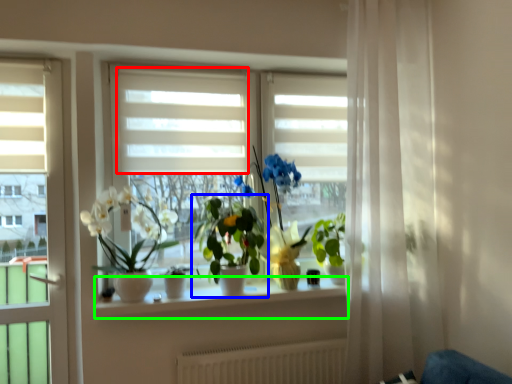
Question: Estimate the real-world distances between objects in this image. Which object is farther from blind (highlighted by a red box), houseplant (highlighted by a blue box) or window sill (highlighted by a green box)?

Choices:
 (A) houseplant
 (B) window sill

Answer: (B)